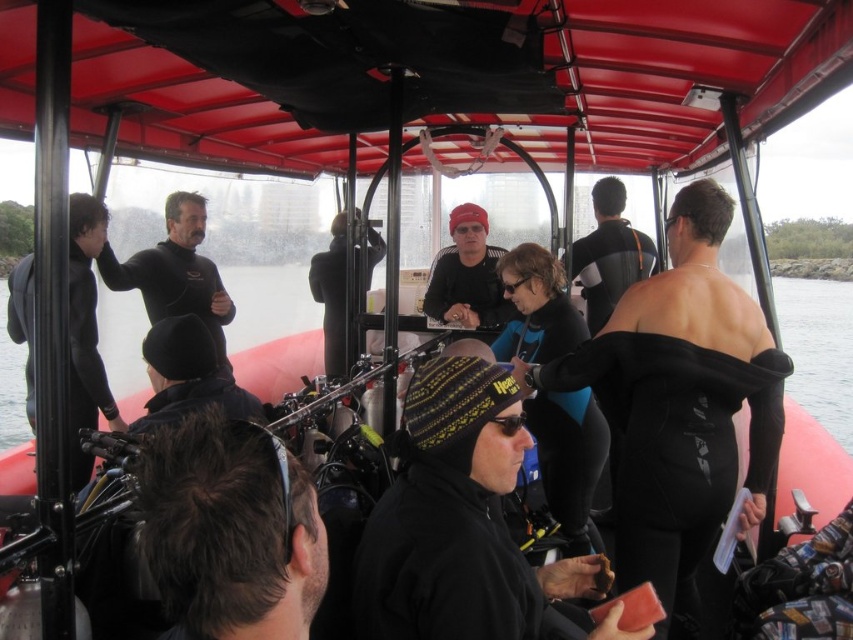
You are a photographer standing on the dock, and you want to take a photo of the black wetsuit at left and the matte black beanie at center so that they appear side by side in the frame. Given their distance apart, is it possible to capture both in a single shot without moving the subjects?

The black wetsuit at left is 1.51 meters away from the matte black beanie at center. Since the distance between them is manageable for a single shot, yes, you can capture both in one frame without moving the subjects.

You are a photographer trying to capture a clear shot of both the black wetsuit at left and the matte black beanie at center. Based on their positions, which object should you focus on first to ensure both are in the frame?

A: The black wetsuit at left is in front of the matte black beanie at center, so you should focus on the matte black beanie at center first to ensure both are visible in the frame.